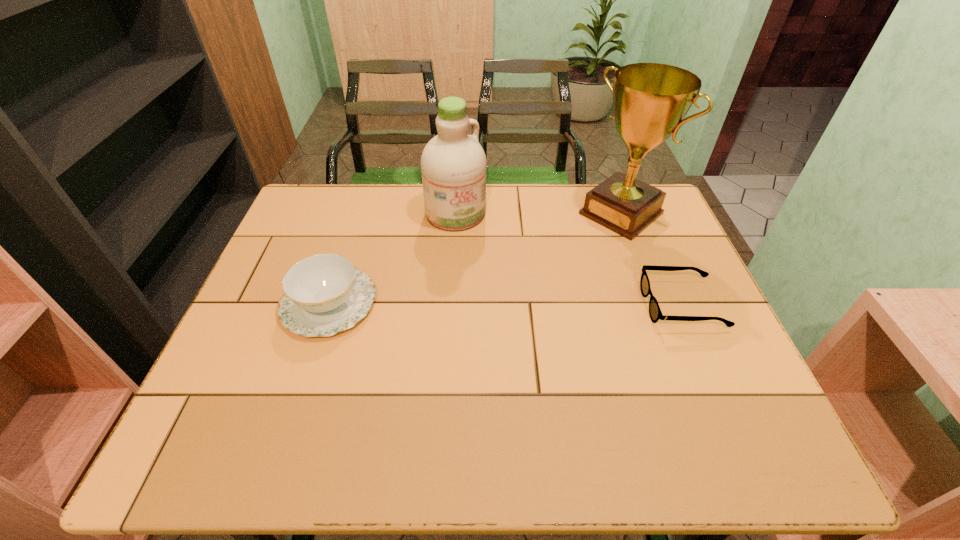
This screenshot has height=540, width=960. Identify the location of free spot on the desktop that is between the chinaware and the spectacles and is positioned on the front label of the third object from right to left. (525, 305).

Identify the location of free space on the desktop that is between the leftmost object and the spectacles and is positioned on the plaque of the award. The image size is (960, 540). click(502, 305).